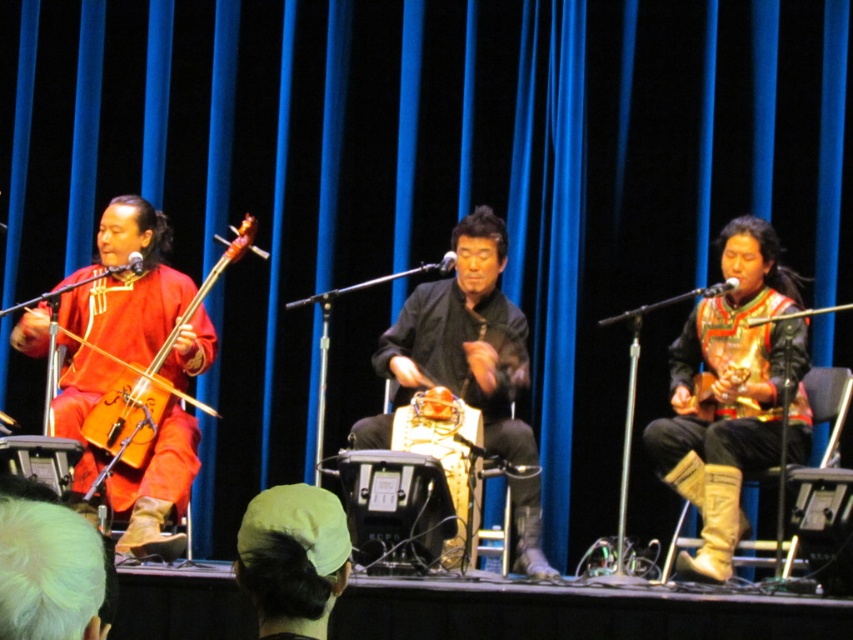
You are a stagehand preparing to adjust the lighting for the performance. You need to position a spotlight on the matte red fabric at left and another on the gold leather boots at right. Based on their positions, which object should you light first if you want to follow the stage layout from front to back?

The gold leather boots at right should be lit first since they are in front of the matte red fabric at left according to the stage layout.

You are a stagehand preparing to adjust the lighting for the performance. You need to ensure that the spotlight reaches both the matte red fabric at left and the gold metallic violin at center. Based on their heights, which object will require a higher placement of the spotlight to fully illuminate?

The matte red fabric at left is taller than the gold metallic violin at center, so the spotlight needs to be placed higher to fully illuminate the matte red fabric at left.

You are a photographer positioned at the back of the stage. You want to capture a clear photo of both the matte red fabric at left and the gold metallic violin at center. Which object should you focus on first to ensure both are in focus?

The matte red fabric at left is closer to the viewer than the gold metallic violin at center, so you should focus on the matte red fabric at left first to ensure both are in focus.